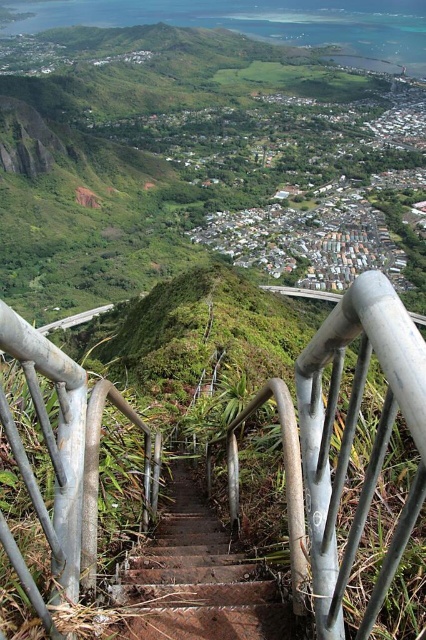
You are standing at the top of the metal stairs and want to take a photo of the valley. There are two points of interest marked as point 1 at coordinates [405,410] and point 2 at coordinates [256,618]. Which point should you focus on to ensure it appears larger in your photo?

Point 1 at coordinates [405,410] is closer to the camera, so focusing on it will make it appear larger in the photo compared to point 2 at coordinates [256,618].

You are a hiker who wants to descend the valley using the rusty metal stairs at center. There is a silver metallic rail at center nearby. If you need to grab the rail to steady yourself, will you be able to reach it without moving your position?

The silver metallic rail at center is 9.44 meters away from the rusty metal stairs at center. Since the distance is quite large, you would not be able to reach the rail without moving closer.